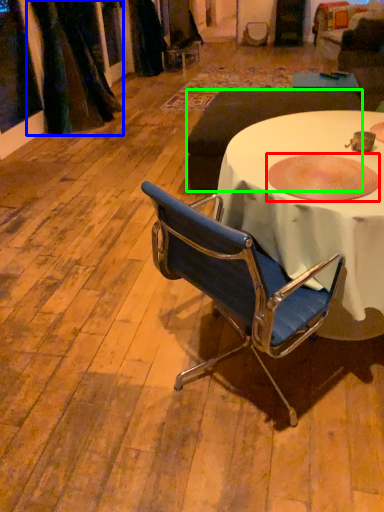
Question: Which object is positioned closest to bowl (highlighted by a red box)? Select from curtain (highlighted by a blue box) and studio couch (highlighted by a green box).

Choices:
 (A) curtain
 (B) studio couch

Answer: (B)